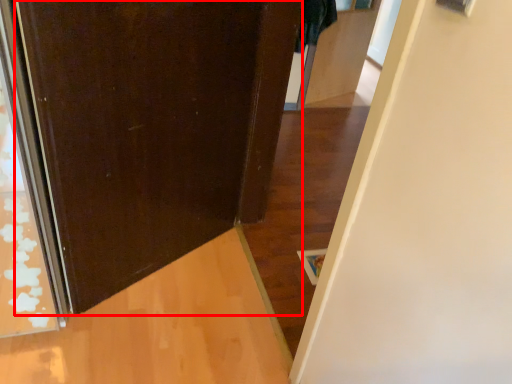
Question: In this image, where is door (annotated by the red box) located relative to door?

Choices:
 (A) left
 (B) right

Answer: (A)